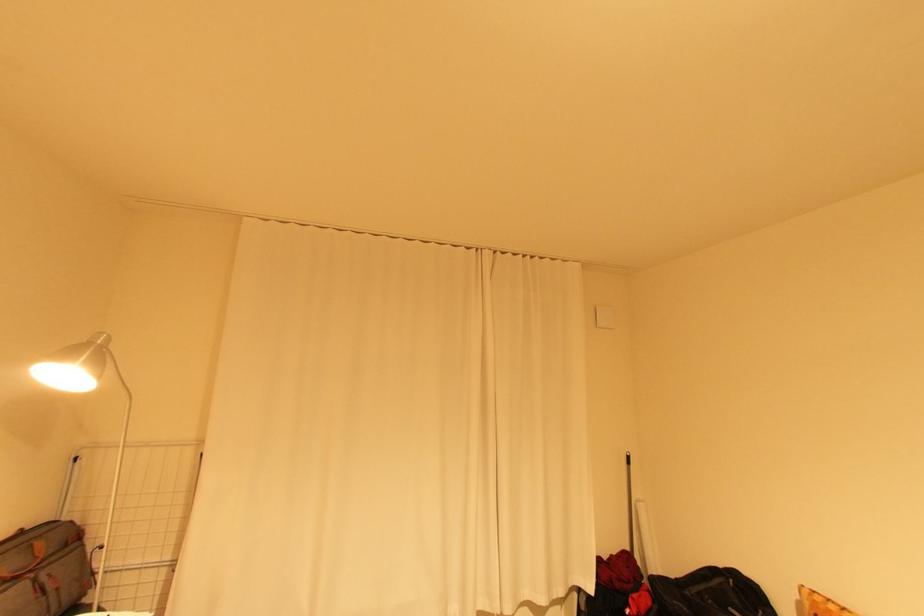
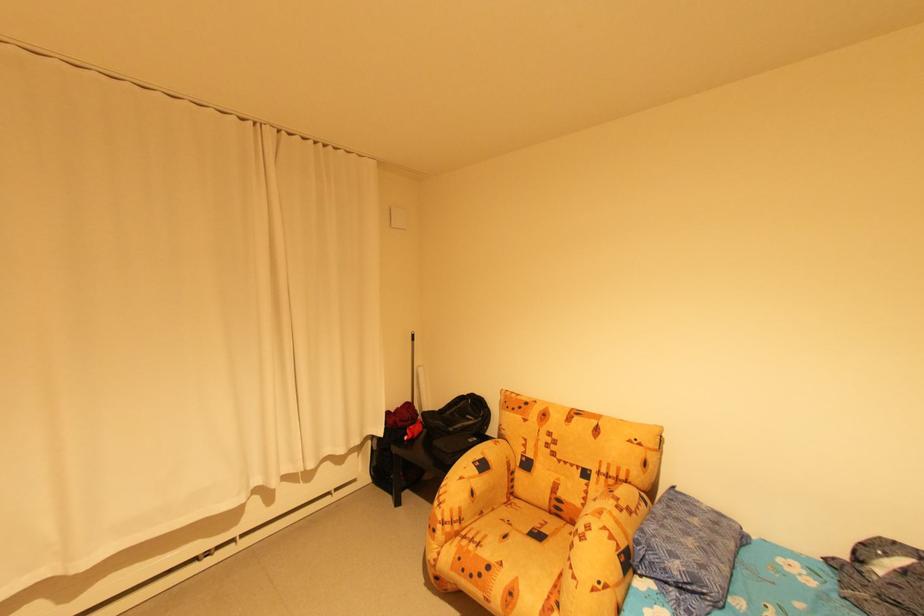
Question: The camera is either moving clockwise (left) or counter-clockwise (right) around the object. The first image is from the beginning of the video and the second image is from the end. Is the camera moving left or right when shooting the video?

Choices:
 (A) Left
 (B) Right

Answer: (A)